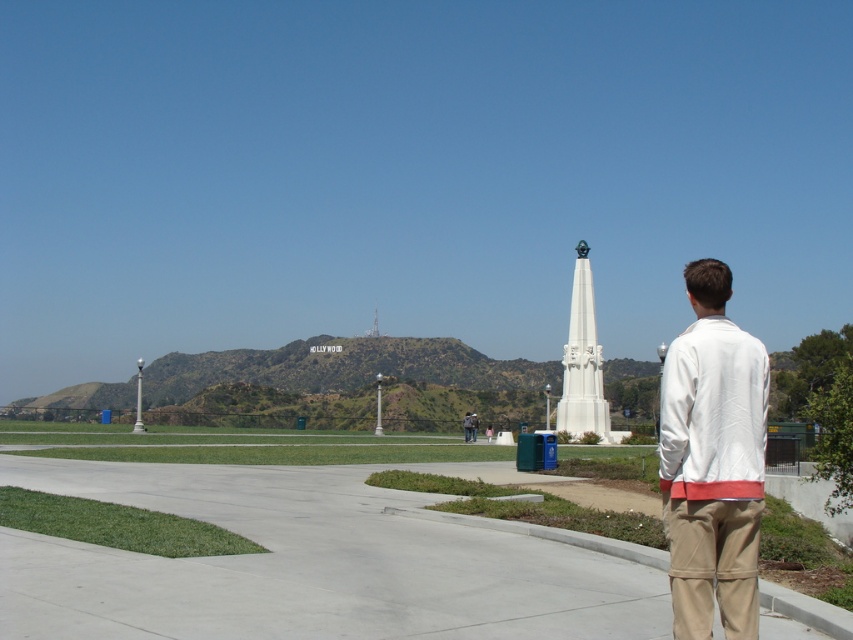
Question: Does gray concrete pavement at center appear over white marble monument at center?

Choices:
 (A) yes
 (B) no

Answer: (B)

Question: Which point is farther to the camera?

Choices:
 (A) (605, 596)
 (B) (751, 547)
 (C) (752, 593)

Answer: (A)

Question: Can you confirm if khaki cotton pants at lower right is positioned to the right of white marble monument at center?

Choices:
 (A) yes
 (B) no

Answer: (B)

Question: Among these objects, which one is farthest from the camera?

Choices:
 (A) white marble monument at center
 (B) white cotton jacket at lower right
 (C) khaki cotton pants at lower right

Answer: (A)

Question: Based on their relative distances, which object is farther from the gray concrete pavement at center?

Choices:
 (A) white cotton shirt at right
 (B) khaki cotton pants at lower right
 (C) white marble monument at center

Answer: (C)

Question: Is white cotton shirt at right closer to camera compared to white marble monument at center?

Choices:
 (A) yes
 (B) no

Answer: (A)